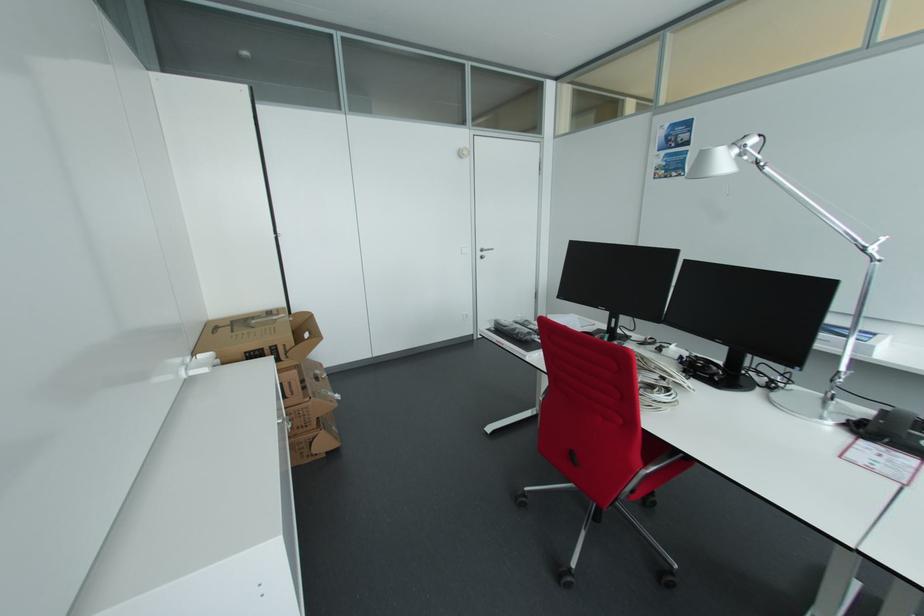
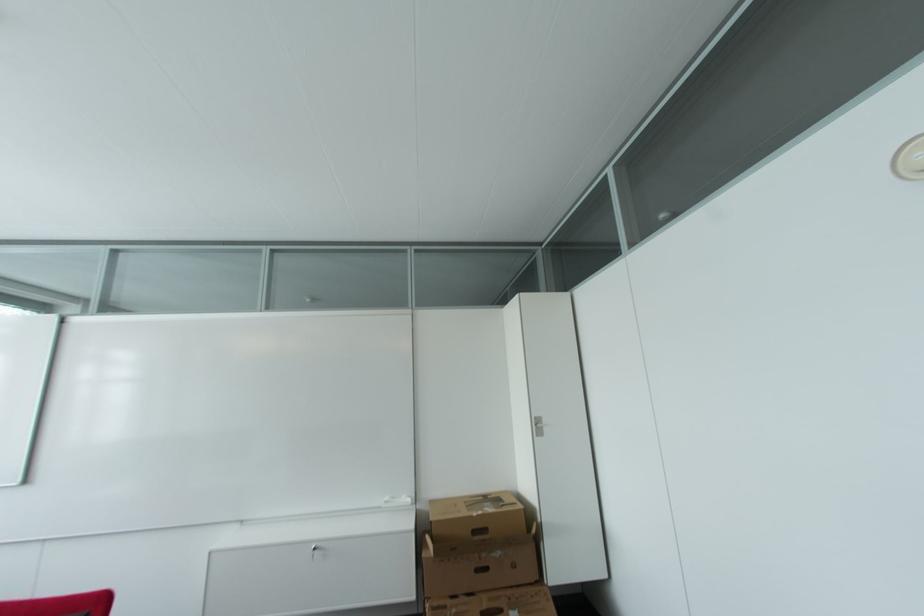
The point at (x=317, y=394) is marked in the first image. Where is the corresponding point in the second image?

(448, 609)